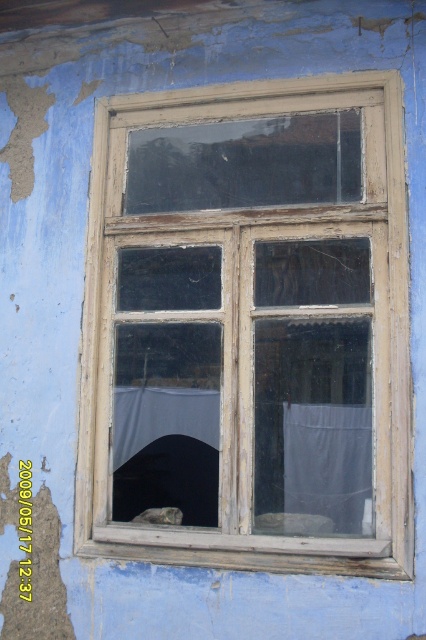
Question: Is weathered wood window frame at center below white sheer curtain at center?

Choices:
 (A) no
 (B) yes

Answer: (A)

Question: Does weathered wood window frame at center lie behind white sheer curtain at center?

Choices:
 (A) yes
 (B) no

Answer: (B)

Question: Is weathered wood window frame at center wider than white sheer curtain at center?

Choices:
 (A) no
 (B) yes

Answer: (B)